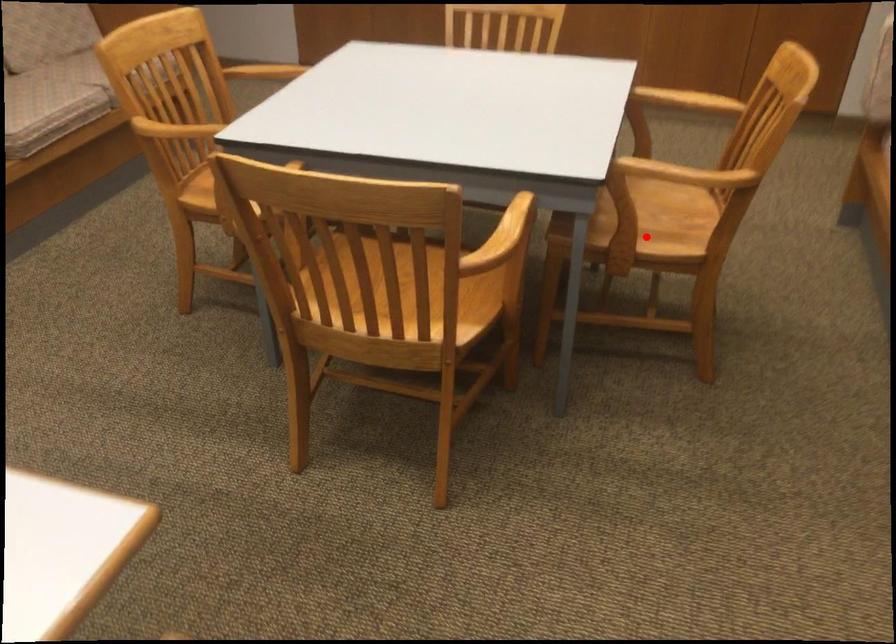
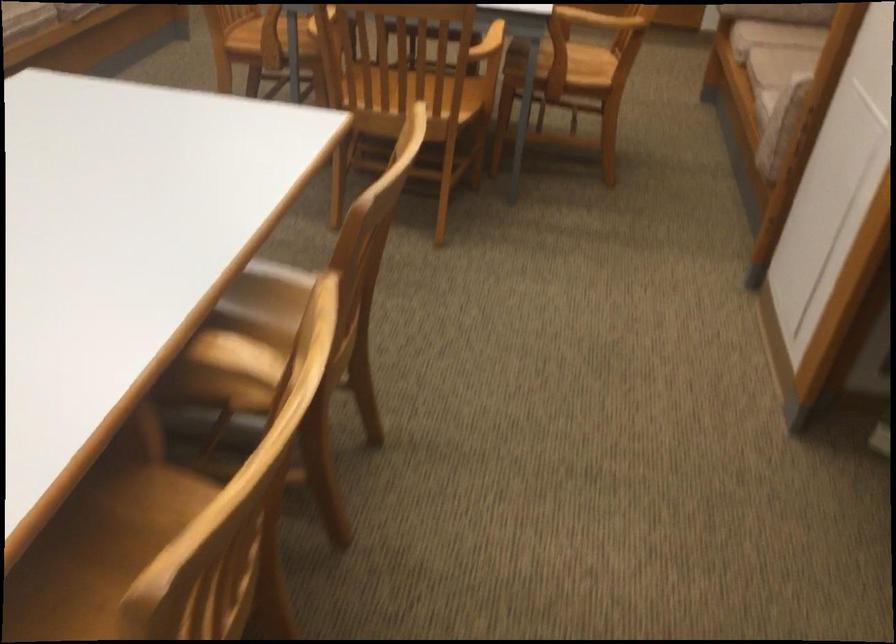
Question: I am providing you with two images of the same scene from different viewpoints. Given a red point in image1, look at the same physical point in image2. Is it:

Choices:
 (A) Closer to the viewpoint
 (B) Farther from the viewpoint

Answer: (B)